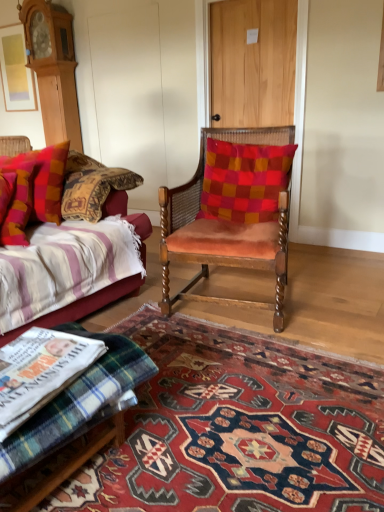
Image resolution: width=384 pixels, height=512 pixels. In order to click on plaid fabric pillow at left, the 3th pillow from the right in this screenshot , I will do pyautogui.click(x=44, y=179).

What is the approximate width of plaid fabric pillow at left, positioned as the 1th pillow in left-to-right order?

plaid fabric pillow at left, positioned as the 1th pillow in left-to-right order, is 16.30 inches wide.

Describe the element at coordinates (18, 198) in the screenshot. I see `plush cotton pillow at left, the 2th pillow in the left-to-right sequence` at that location.

Locate an element on the screen. The width and height of the screenshot is (384, 512). plush cotton pillow at left, the 2th pillow in the right-to-left sequence is located at coordinates (18, 198).

What is the approximate height of carpet with intricate patterns at center?

It is 4.24 centimeters.

This screenshot has height=512, width=384. Identify the location of velvet cushion at center, placed as the 1th pillow when sorted from right to left. (244, 181).

What do you see at coordinates (253, 62) in the screenshot? The width and height of the screenshot is (384, 512). I see `light brown wooden door at upper center` at bounding box center [253, 62].

Describe the element at coordinates (77, 404) in the screenshot. I see `plaid fabric footrest at lower left` at that location.

Where is `velvet striped couch at left`? Image resolution: width=384 pixels, height=512 pixels. velvet striped couch at left is located at coordinates (80, 307).

At what (x,y) coordinates should I click in order to perform the action: click on plaid fabric pillow at left, positioned as the 1th pillow in left-to-right order. Please return your answer as a coordinate pair (x, y). Image resolution: width=384 pixels, height=512 pixels. Looking at the image, I should click on (44, 179).

Is velvet cushion at center, positioned as the 3th pillow in left-to-right order, behind light brown wooden door at upper center?

No, velvet cushion at center, positioned as the 3th pillow in left-to-right order, is closer to the viewer.

From the image's perspective, is velvet cushion at center, placed as the 1th pillow when sorted from right to left, below light brown wooden door at upper center?

Yes.

In terms of size, does velvet cushion at center, placed as the 1th pillow when sorted from right to left, appear bigger or smaller than light brown wooden door at upper center?

In the image, velvet cushion at center, placed as the 1th pillow when sorted from right to left, appears to be smaller than light brown wooden door at upper center.

Is velvet cushion at center, positioned as the 3th pillow in left-to-right order, not close to light brown wooden door at upper center?

Yes.

Consider the image. Choose the correct answer: Is velvet orange chair at center inside velvet cushion at center, positioned as the 3th pillow in left-to-right order, or outside it?

velvet orange chair at center is not enclosed by velvet cushion at center, positioned as the 3th pillow in left-to-right order.

Identify the location of chair in front of the velvet cushion at center, positioned as the 3th pillow in left-to-right order. This screenshot has height=512, width=384. (232, 210).

Does velvet orange chair at center appear on the left side of velvet cushion at center, positioned as the 3th pillow in left-to-right order?

Indeed, velvet orange chair at center is positioned on the left side of velvet cushion at center, positioned as the 3th pillow in left-to-right order.

In terms of size, does velvet orange chair at center appear bigger or smaller than light brown wooden door at upper center?

Clearly, velvet orange chair at center is larger in size than light brown wooden door at upper center.

Is velvet orange chair at center inside or outside of light brown wooden door at upper center?

velvet orange chair at center lies outside light brown wooden door at upper center.

Who is shorter, velvet orange chair at center or light brown wooden door at upper center?

With less height is velvet orange chair at center.

Does velvet striped couch at left contain plaid fabric pillow at left, positioned as the 1th pillow in left-to-right order?

Yes, plaid fabric pillow at left, positioned as the 1th pillow in left-to-right order, is inside velvet striped couch at left.

Is velvet striped couch at left aimed at plaid fabric pillow at left, positioned as the 1th pillow in left-to-right order?

Yes, velvet striped couch at left is turned towards plaid fabric pillow at left, positioned as the 1th pillow in left-to-right order.

Considering the points (86, 309) and (33, 158), which point is in front, point (86, 309) or point (33, 158)?

Point (86, 309)

Between velvet striped couch at left and velvet cushion at center, positioned as the 3th pillow in left-to-right order, which one appears on the left side from the viewer's perspective?

Positioned to the left is velvet striped couch at left.

Which point is more forward, (117, 204) or (282, 185)?

The point (282, 185) is closer to the camera.

Considering the relative sizes of velvet striped couch at left and velvet cushion at center, placed as the 1th pillow when sorted from right to left, in the image provided, is velvet striped couch at left taller than velvet cushion at center, placed as the 1th pillow when sorted from right to left,?

Indeed, velvet striped couch at left has a greater height compared to velvet cushion at center, placed as the 1th pillow when sorted from right to left.

Looking at the image, does velvet striped couch at left seem bigger or smaller compared to velvet cushion at center, positioned as the 3th pillow in left-to-right order?

velvet striped couch at left is bigger than velvet cushion at center, positioned as the 3th pillow in left-to-right order.

From a real-world perspective, which object rests below the other?

velvet striped couch at left.

Is velvet cushion at center, placed as the 1th pillow when sorted from right to left, positioned with its back to velvet striped couch at left?

velvet cushion at center, placed as the 1th pillow when sorted from right to left, does not have its back to velvet striped couch at left.

From the image's perspective, count 3rd pillows upward from the velvet striped couch at left and point to it. Please provide its 2D coordinates.

[(244, 181)]

From the image's perspective, is velvet cushion at center, placed as the 1th pillow when sorted from right to left, located above or below velvet striped couch at left?

velvet cushion at center, placed as the 1th pillow when sorted from right to left, is above velvet striped couch at left.

From a real-world perspective, is velvet cushion at center, positioned as the 3th pillow in left-to-right order, positioned over carpet with intricate patterns at center based on gravity?

Yes, from a real-world perspective, velvet cushion at center, positioned as the 3th pillow in left-to-right order, is above carpet with intricate patterns at center.

From the image's perspective, which is below, velvet cushion at center, positioned as the 3th pillow in left-to-right order, or carpet with intricate patterns at center?

carpet with intricate patterns at center is shown below in the image.

Is velvet cushion at center, placed as the 1th pillow when sorted from right to left, not near carpet with intricate patterns at center?

No, velvet cushion at center, placed as the 1th pillow when sorted from right to left, is not far from carpet with intricate patterns at center.

Which is more to the right, velvet cushion at center, placed as the 1th pillow when sorted from right to left, or carpet with intricate patterns at center?

From the viewer's perspective, velvet cushion at center, placed as the 1th pillow when sorted from right to left, appears more on the right side.

At what (x,y) coordinates should I click in order to perform the action: click on door lying behind the velvet cushion at center, placed as the 1th pillow when sorted from right to left. Please return your answer as a coordinate pair (x, y). Image resolution: width=384 pixels, height=512 pixels. Looking at the image, I should click on (253, 62).

Image resolution: width=384 pixels, height=512 pixels. Identify the location of chair in front of the velvet cushion at center, placed as the 1th pillow when sorted from right to left. (232, 210).

Considering their positions, is light brown wooden door at upper center positioned closer to carpet with intricate patterns at center than velvet cushion at center, placed as the 1th pillow when sorted from right to left?

The object closer to carpet with intricate patterns at center is velvet cushion at center, placed as the 1th pillow when sorted from right to left.

When comparing their distances from velvet cushion at center, placed as the 1th pillow when sorted from right to left, does plaid fabric footrest at lower left or velvet orange chair at center seem further?

plaid fabric footrest at lower left is further to velvet cushion at center, placed as the 1th pillow when sorted from right to left.

Which object lies nearer to the anchor point velvet striped couch at left, plaid fabric footrest at lower left or velvet orange chair at center?

plaid fabric footrest at lower left is closer to velvet striped couch at left.

Estimate the real-world distances between objects in this image. Which object is closer to plush cotton pillow at left, the 2th pillow in the right-to-left sequence, plaid fabric footrest at lower left or velvet orange chair at center?

velvet orange chair at center.

Considering their positions, is velvet orange chair at center positioned further to carpet with intricate patterns at center than plaid fabric pillow at left, the 3th pillow from the right?

plaid fabric pillow at left, the 3th pillow from the right.

Looking at the image, which one is located closer to plush cotton pillow at left, the 2th pillow in the left-to-right sequence, light brown wooden door at upper center or carpet with intricate patterns at center?

carpet with intricate patterns at center.

Looking at the image, which one is located further to carpet with intricate patterns at center, plaid fabric footrest at lower left or light brown wooden door at upper center?

Among the two, light brown wooden door at upper center is located further to carpet with intricate patterns at center.

Estimate the real-world distances between objects in this image. Which object is further from carpet with intricate patterns at center, velvet striped couch at left or velvet cushion at center, placed as the 1th pillow when sorted from right to left?

Among the two, velvet cushion at center, placed as the 1th pillow when sorted from right to left, is located further to carpet with intricate patterns at center.

In order to click on pillow between plaid fabric pillow at left, the 3th pillow from the right, and velvet orange chair at center in this screenshot , I will do `click(18, 198)`.

You are a GUI agent. You are given a task and a screenshot of the screen. Output one action in this format:
    pyautogui.click(x=<x>, y=<y>)
    Task: Click on the footrest situated between plush cotton pillow at left, the 2th pillow in the right-to-left sequence, and velvet orange chair at center from left to right
    
    Given the screenshot: What is the action you would take?
    pyautogui.click(x=77, y=404)

Identify the location of footrest between carpet with intricate patterns at center and velvet striped couch at left along the z-axis. This screenshot has height=512, width=384. (77, 404).

Image resolution: width=384 pixels, height=512 pixels. I want to click on studio couch located between carpet with intricate patterns at center and velvet cushion at center, placed as the 1th pillow when sorted from right to left, in the depth direction, so click(x=80, y=307).